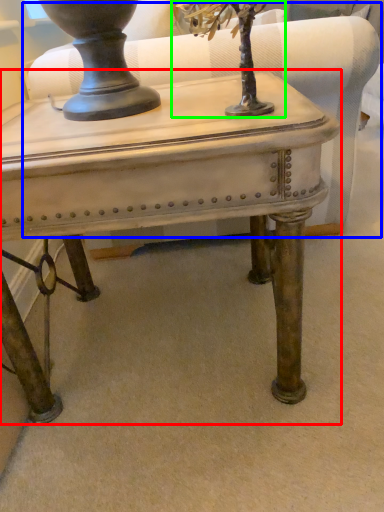
Question: Which object is the closest to the table (highlighted by a red box)? Choose among these: swivel chair (highlighted by a blue box) or tree (highlighted by a green box).

Choices:
 (A) swivel chair
 (B) tree

Answer: (B)